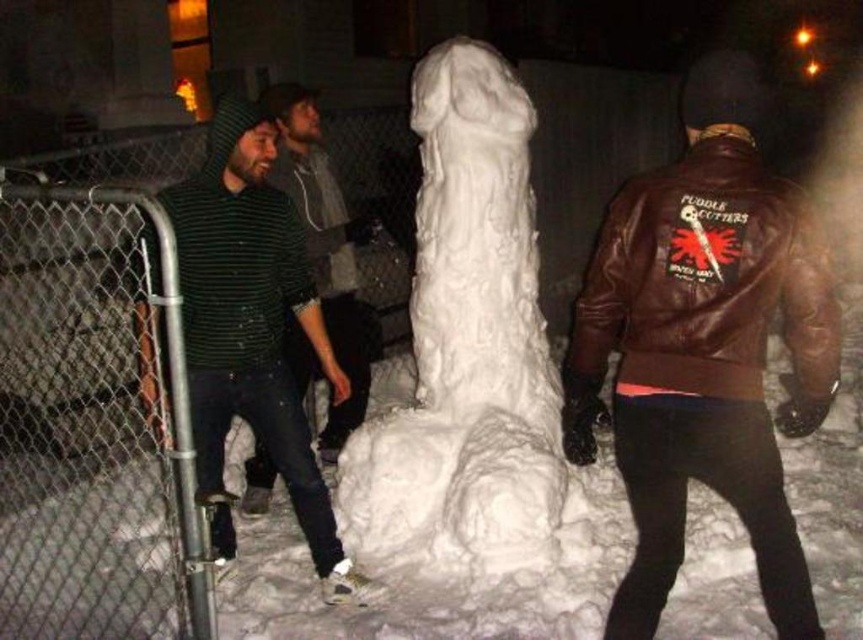
You are a photographer standing at the edge of the snow sculpture area. You want to take a photo that includes both the brown leather jacket at center and the green striped sweater at center without any overlap. Given that your camera has a maximum field of view of 2 meters, will you be able to capture both subjects in a single frame?

The brown leather jacket at center is 2.26 meters from the green striped sweater at center. Since the distance between them exceeds the camera field of view of 2 meters, you cannot capture both in a single frame without overlap.

You are organizing a winter festival and need to ensure that all participants wear appropriate clothing. You notice two green striped sweater at left and green striped sweater at center in the snow sculpture scene. Which sweater would you recommend for someone who needs a larger size?

The green striped sweater at left is bigger than the green striped sweater at center, so it would be the better choice for someone needing a larger size.